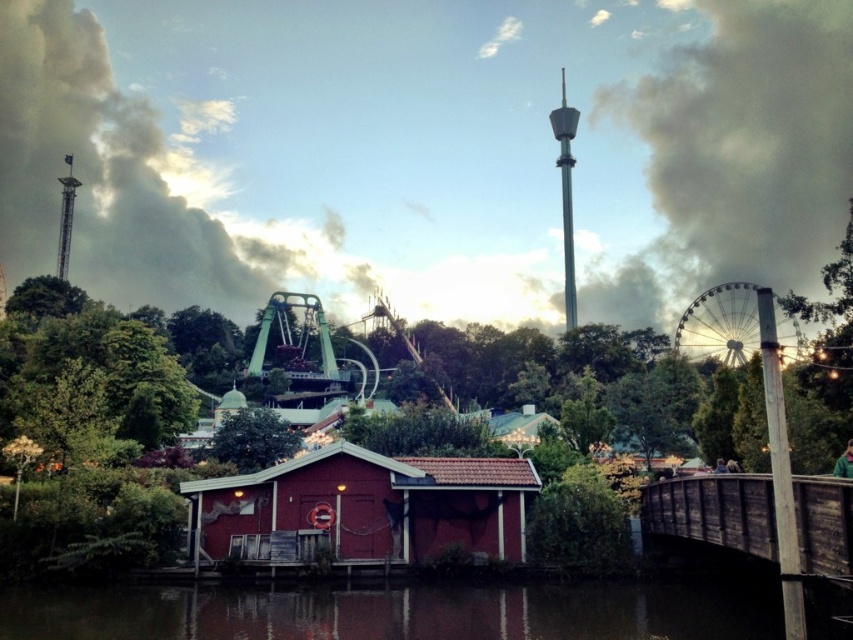
Is red matte building at center to the left of wooden bridge at lower right from the viewer's perspective?

Yes, red matte building at center is to the left of wooden bridge at lower right.

Is red matte building at center below wooden bridge at lower right?

Incorrect, red matte building at center is not positioned below wooden bridge at lower right.

Who is more distant from viewer, (628, 387) or (817, 536)?

The point (628, 387) is behind.

Locate an element on the screen. red matte building at center is located at coordinates (254, 474).

Can you confirm if transparent water at lower center is smaller than wooden bridge at lower right?

Actually, transparent water at lower center might be larger than wooden bridge at lower right.

Does transparent water at lower center appear on the left side of wooden bridge at lower right?

Yes, transparent water at lower center is to the left of wooden bridge at lower right.

Does point (300, 596) come behind point (839, 557)?

Yes, it is.

Find the location of a particular element. transparent water at lower center is located at coordinates tap(392, 612).

Which is below, red matte building at center or transparent water at lower center?

transparent water at lower center is lower down.

Who is more forward, [438,512] or [469,595]?

Point [469,595]

Where is `red matte building at center`? The width and height of the screenshot is (853, 640). red matte building at center is located at coordinates (254, 474).